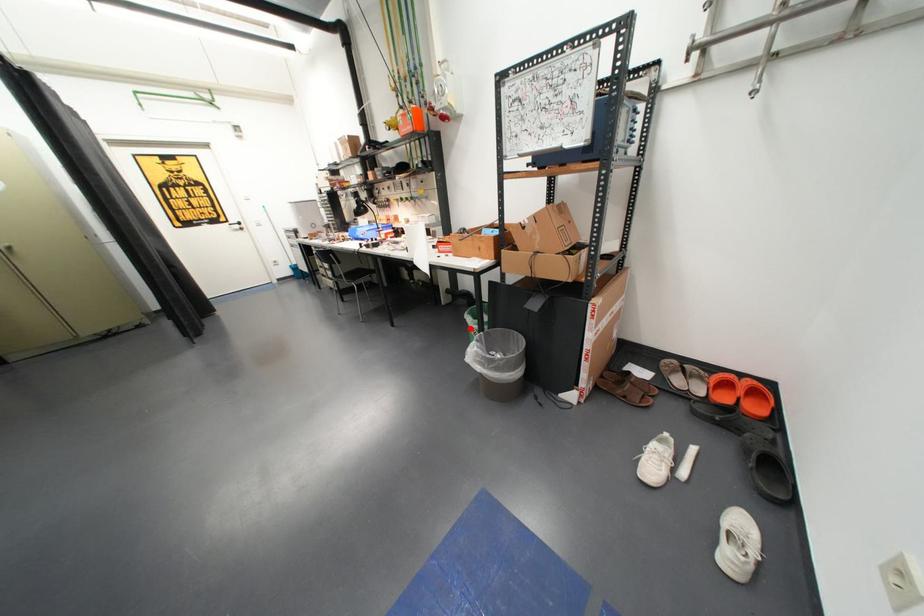
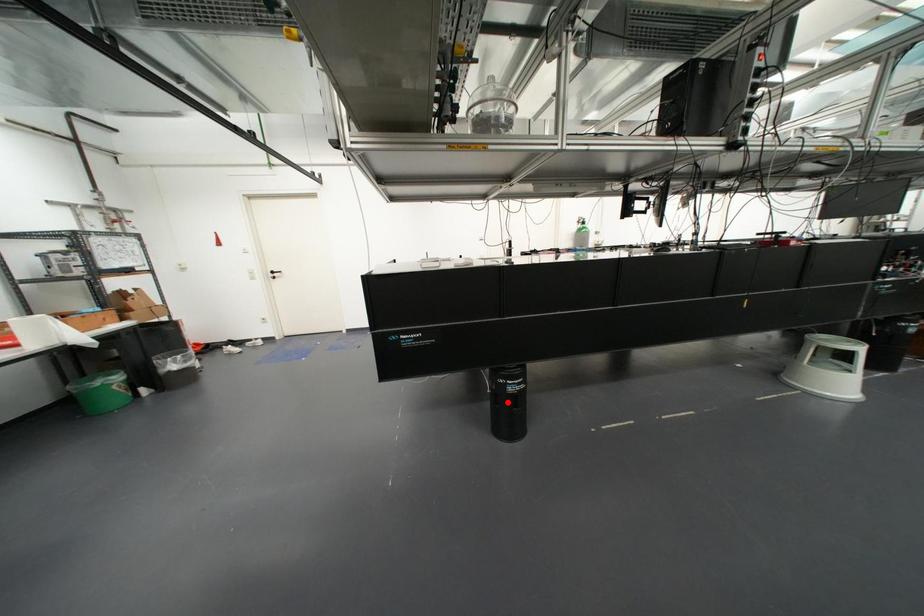
I am providing you with two images of the same scene from different viewpoints. A red point is marked on the first image and another point is marked on the second image. Are the points marked in image1 and image2 representing the same 3D position?

No